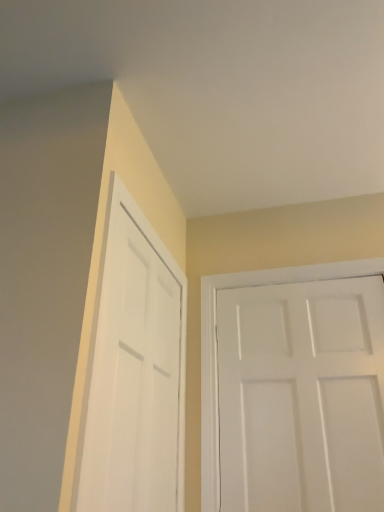
Question: Is white matte door at right, which is counted as the 2th door, starting from the left, oriented towards white matte door at left, marked as the 1th door in a left-to-right arrangement?

Choices:
 (A) no
 (B) yes

Answer: (B)

Question: Is white matte door at right, which is counted as the 2th door, starting from the left, at the left side of white matte door at left, marked as the 1th door in a left-to-right arrangement?

Choices:
 (A) no
 (B) yes

Answer: (A)

Question: Can you confirm if white matte door at right, which is counted as the 2th door, starting from the left, is shorter than white matte door at left, acting as the 2th door starting from the right?

Choices:
 (A) no
 (B) yes

Answer: (B)

Question: Considering the relative sizes of white matte door at right, which is counted as the 2th door, starting from the left, and white matte door at left, marked as the 1th door in a left-to-right arrangement, in the image provided, is white matte door at right, which is counted as the 2th door, starting from the left, wider than white matte door at left, marked as the 1th door in a left-to-right arrangement,?

Choices:
 (A) no
 (B) yes

Answer: (B)

Question: From a real-world perspective, is white matte door at right, which is counted as the 2th door, starting from the left, beneath white matte door at left, marked as the 1th door in a left-to-right arrangement?

Choices:
 (A) no
 (B) yes

Answer: (B)

Question: Can you confirm if white matte door at right, which is the 1th door from right to left, is thinner than white matte door at left, marked as the 1th door in a left-to-right arrangement?

Choices:
 (A) yes
 (B) no

Answer: (B)

Question: From the image's perspective, would you say white matte door at left, marked as the 1th door in a left-to-right arrangement, is shown under white matte door at right, which is the 1th door from right to left?

Choices:
 (A) no
 (B) yes

Answer: (A)

Question: Is white matte door at left, marked as the 1th door in a left-to-right arrangement, further to camera compared to white matte door at right, which is the 1th door from right to left?

Choices:
 (A) yes
 (B) no

Answer: (B)

Question: Can you confirm if white matte door at left, acting as the 2th door starting from the right, is wider than white matte door at right, which is the 1th door from right to left?

Choices:
 (A) yes
 (B) no

Answer: (B)

Question: Can you confirm if white matte door at left, acting as the 2th door starting from the right, is positioned to the right of white matte door at right, which is counted as the 2th door, starting from the left?

Choices:
 (A) no
 (B) yes

Answer: (A)

Question: Is white matte door at left, acting as the 2th door starting from the right, oriented away from white matte door at right, which is counted as the 2th door, starting from the left?

Choices:
 (A) no
 (B) yes

Answer: (A)

Question: Is white matte door at left, acting as the 2th door starting from the right, far away from white matte door at right, which is the 1th door from right to left?

Choices:
 (A) no
 (B) yes

Answer: (A)

Question: From the image's perspective, is white matte door at left, acting as the 2th door starting from the right, located above or below white matte door at right, which is the 1th door from right to left?

Choices:
 (A) above
 (B) below

Answer: (A)